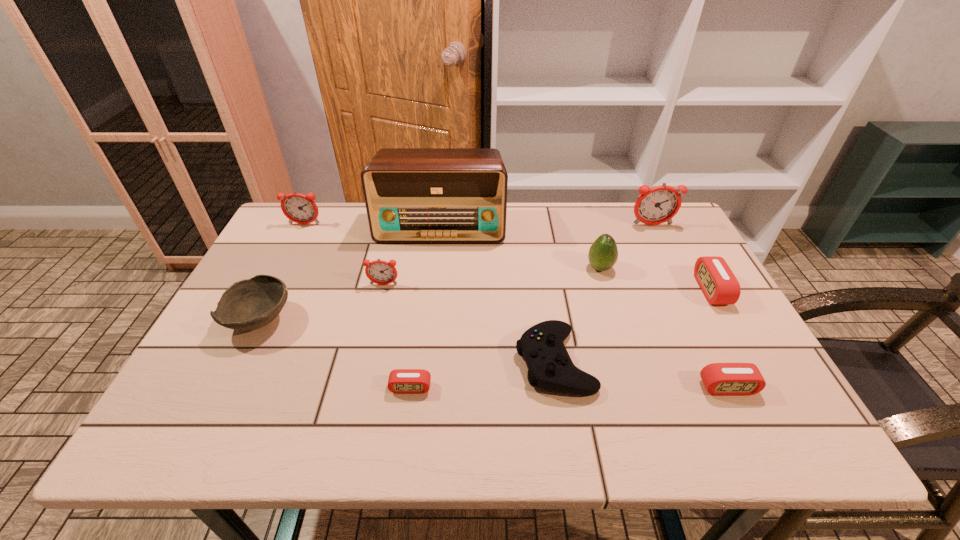
Locate an element on the screen. object located at the far left corner is located at coordinates (298, 208).

I want to click on object that is at the far right corner, so click(659, 204).

You are a GUI agent. You are given a task and a screenshot of the screen. Output one action in this format:
    pyautogui.click(x=<x>, y=<y>)
    Task: Click on the free space at the far edge
    The height and width of the screenshot is (540, 960).
    Given the screenshot: What is the action you would take?
    pyautogui.click(x=619, y=213)

Where is `free space at the near edge`? free space at the near edge is located at coordinates (556, 438).

Image resolution: width=960 pixels, height=540 pixels. In the image, there is a desktop. Identify the location of vacant space at the left edge. (304, 262).

Find the location of a particular element. The height and width of the screenshot is (540, 960). vacant space at the right edge is located at coordinates (693, 248).

Locate an element on the screen. vacant point at the far left corner is located at coordinates (292, 236).

Locate an element on the screen. Image resolution: width=960 pixels, height=540 pixels. vacant space at the far right corner of the desktop is located at coordinates (643, 225).

This screenshot has width=960, height=540. I want to click on blank region between the leftmost pink alarm clock and the fifth object from right to left, so click(x=483, y=374).

I want to click on empty space that is in between the leftmost alarm clock and the third shortest alarm clock, so click(x=508, y=257).